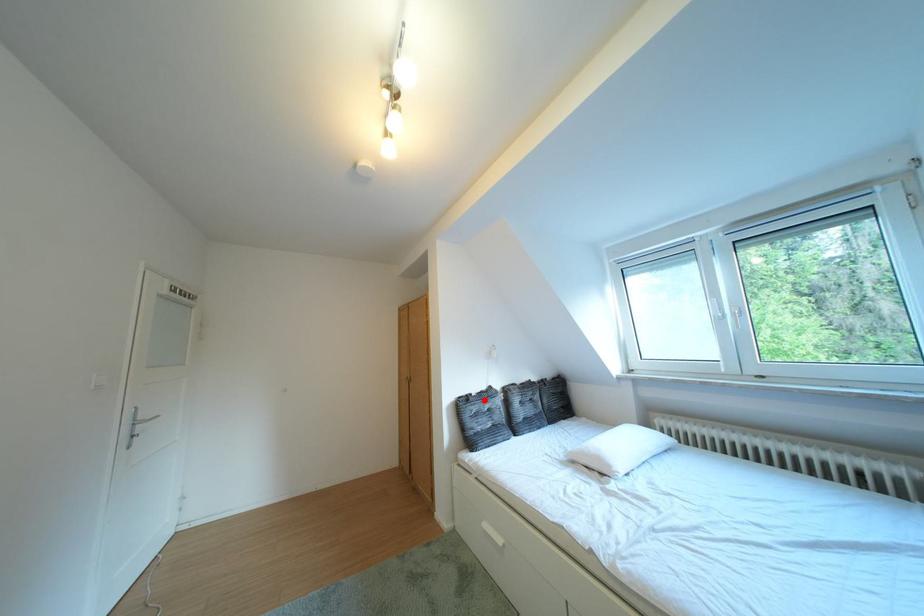
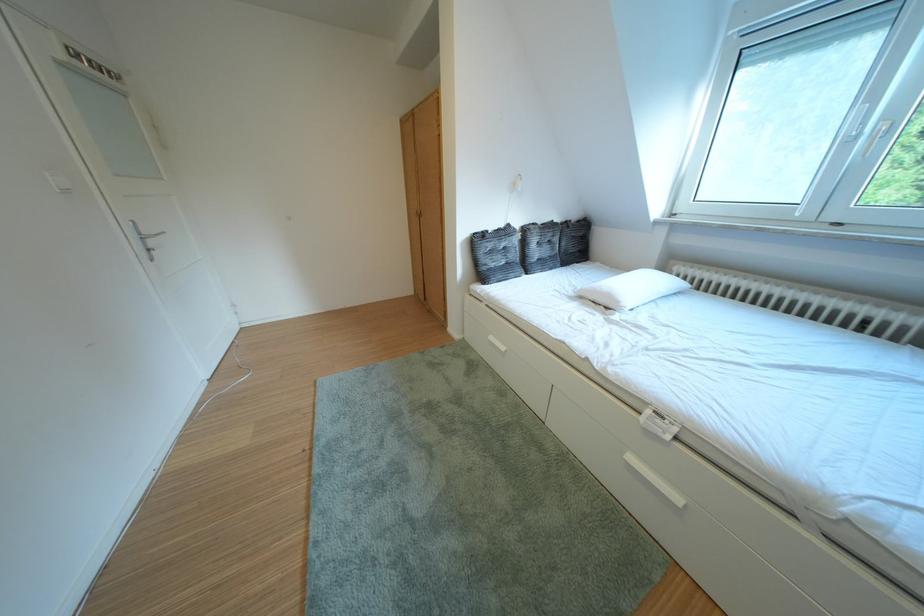
In the second image, find the point that corresponds to the highlighted location in the first image.

(500, 237)